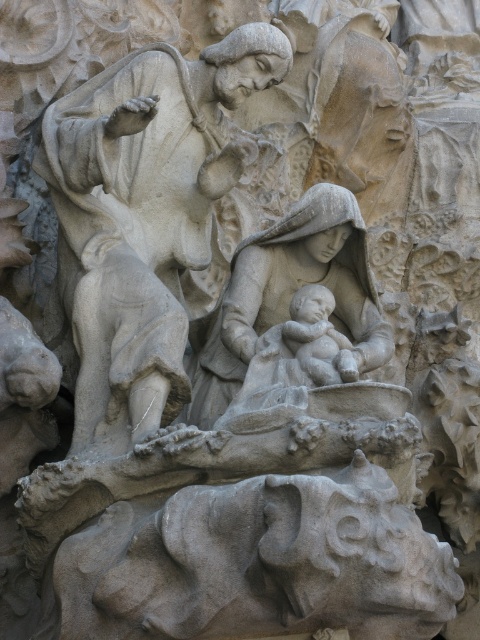
In the scene shown: You are an art conservator tasked with measuring the distance between the gray stone statue of mother holding baby at center and the nearest edge of the stone carving. The statue is 2 meters tall. Can you determine if the statue is positioned centrally within the carving based on the given information?

The gray stone statue of mother holding baby at center is positioned centrally within the carving since it is located at the center and the description mentions it as the central figure.

You are standing at the base of a large stone carving. There is a stone statue at upper center that you want to see up close. Given that the statue is 77.48 meters away from you, can you walk directly to it?

The stone statue at upper center is 77.48 meters away from the viewer. Since this distance is quite large, you would need to walk a significant distance to reach it, assuming there is a clear path. However, the question does not provide information about obstacles or accessibility, so we can only confirm the distance.

You are an archaeologist examining the stone carving. You notice a point labeled at coordinates (x=144, y=212). Based on the scene description, what does this point most likely represent?

The point at (x=144, y=212) corresponds to the stone statue at upper center, which is the central figure of the Madonna and Child in the carving.